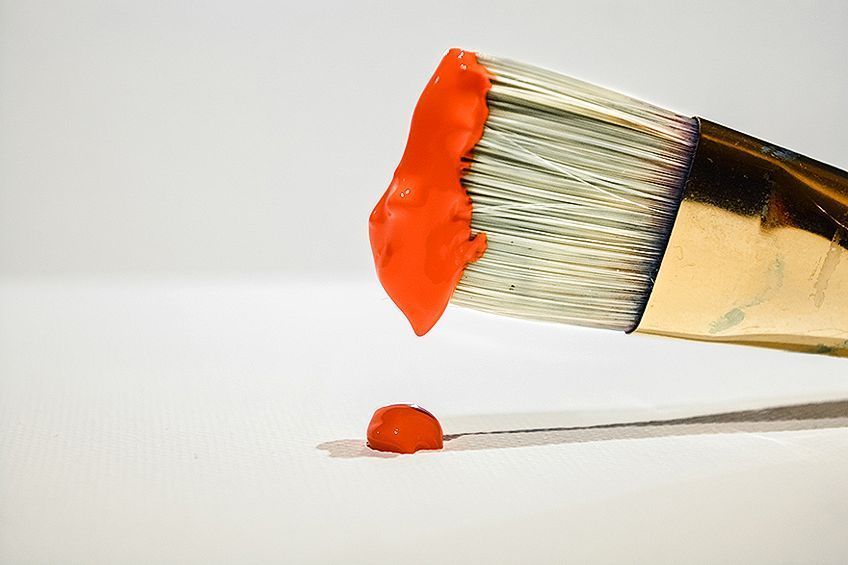
Where is `paint`? paint is located at coordinates pyautogui.click(x=438, y=181), pyautogui.click(x=416, y=432).